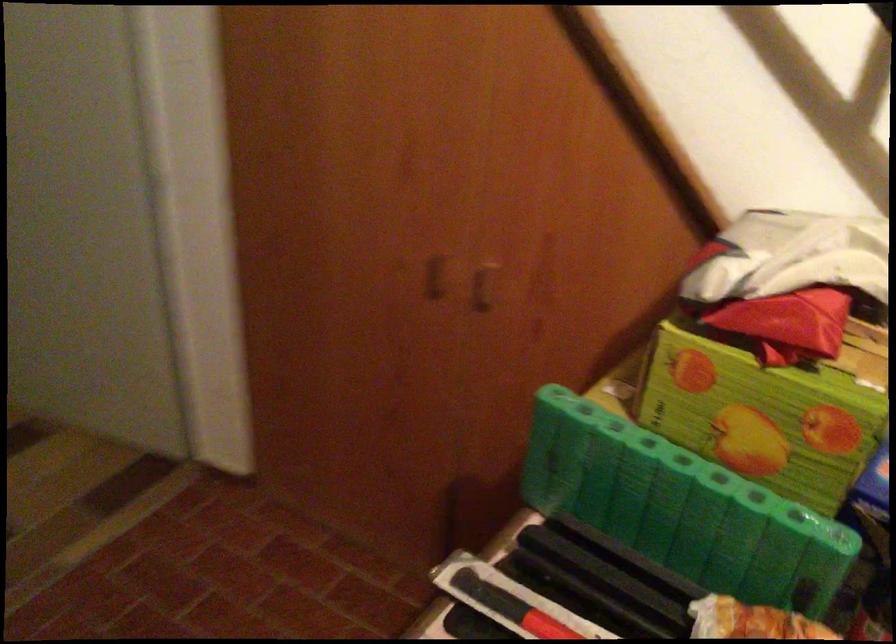
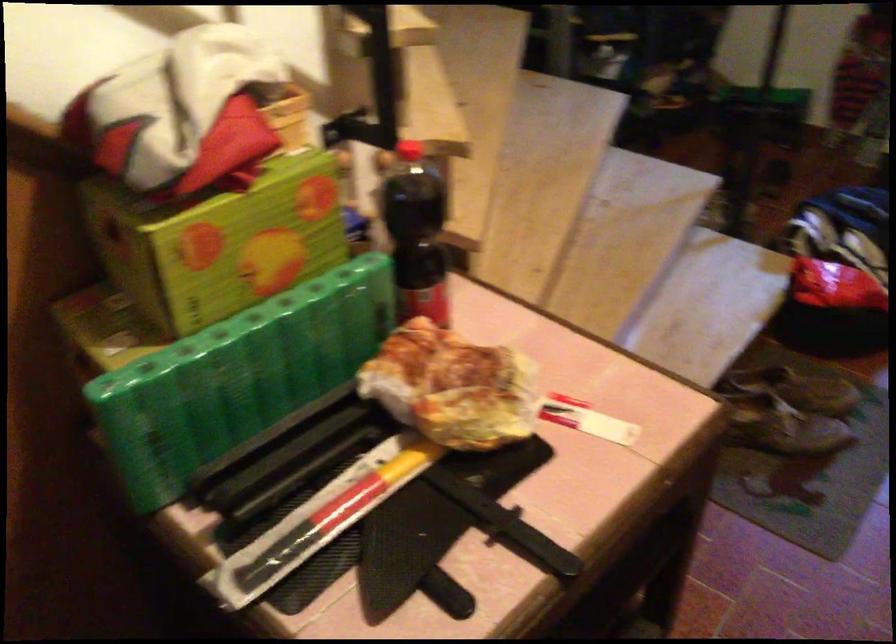
Based on the continuous images, in which direction is the camera rotating?

The camera rotated toward right-down.